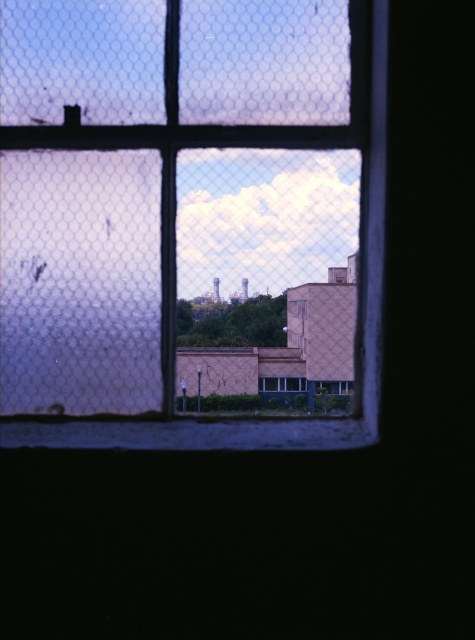
Question: Which of the following is the closest to the observer?

Choices:
 (A) (268, 378)
 (B) (333, 129)

Answer: (B)

Question: Which point is closer to the camera?

Choices:
 (A) clear glass window at center
 (B) blue glass window at center

Answer: (A)

Question: Which point appears closest to the camera in this image?

Choices:
 (A) (303, 378)
 (B) (296, 448)

Answer: (B)

Question: Considering the relative positions of clear glass window at center and blue glass window at center in the image provided, where is clear glass window at center located with respect to blue glass window at center?

Choices:
 (A) above
 (B) below

Answer: (A)

Question: Does clear glass window at center have a larger size compared to blue glass window at center?

Choices:
 (A) no
 (B) yes

Answer: (B)

Question: Does clear glass window at center lie behind blue glass window at center?

Choices:
 (A) no
 (B) yes

Answer: (A)